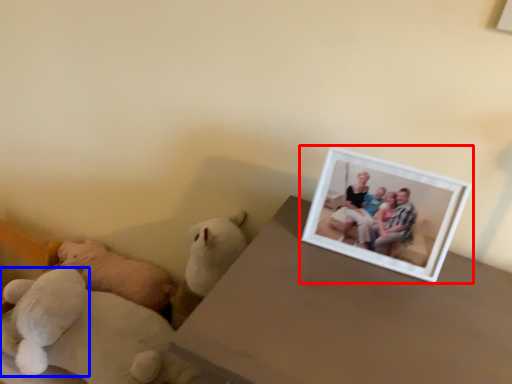
Question: Which object is further to the camera taking this photo, picture frame (highlighted by a red box) or teddy bear (highlighted by a blue box)?

Choices:
 (A) picture frame
 (B) teddy bear

Answer: (B)